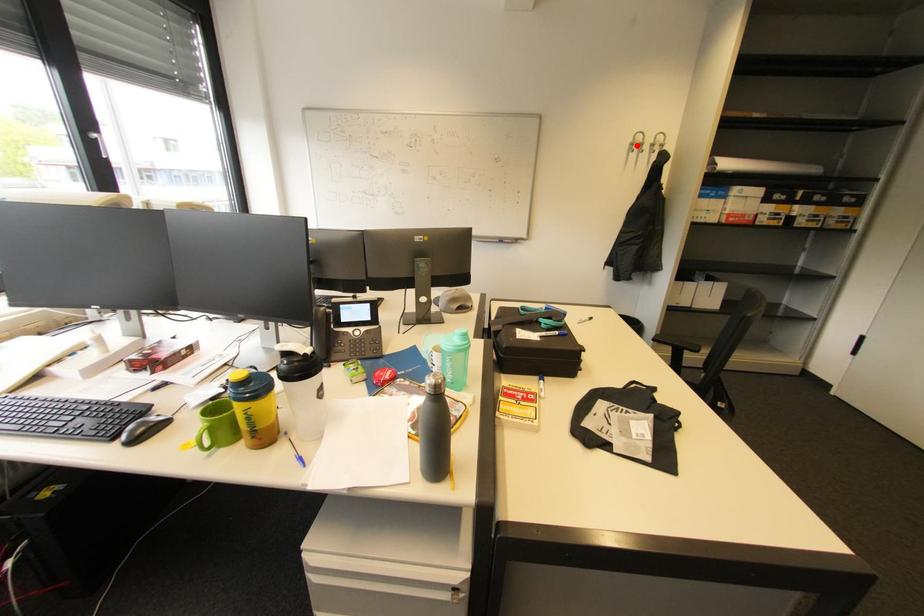
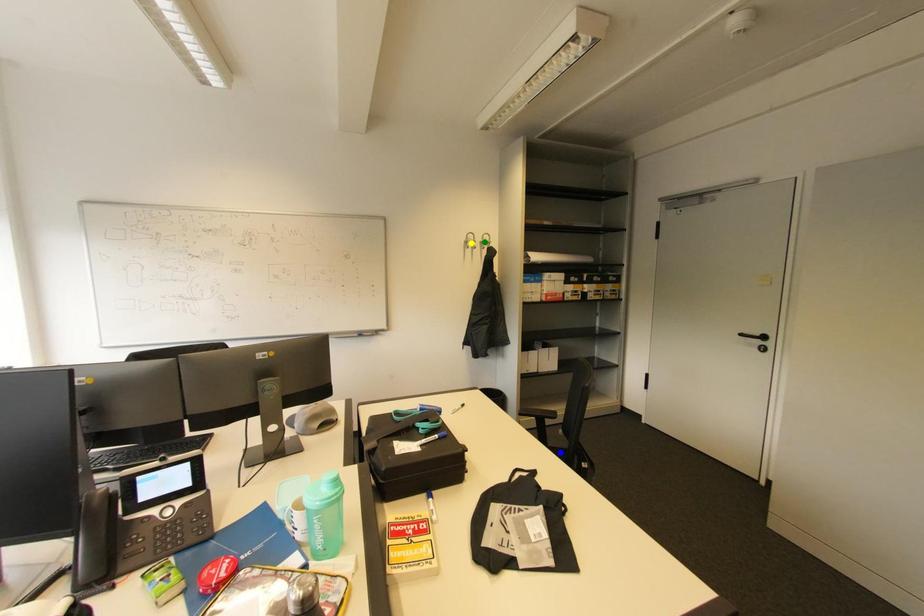
Question: I am providing you with two images of the same scene from different viewpoints. A red point is marked on the first image. You are given multiple points on the second image. Can you choose the point in image 2 that corresponds to the point in image 1?

Choices:
 (A) blue point
 (B) green point
 (C) yellow point

Answer: (C)